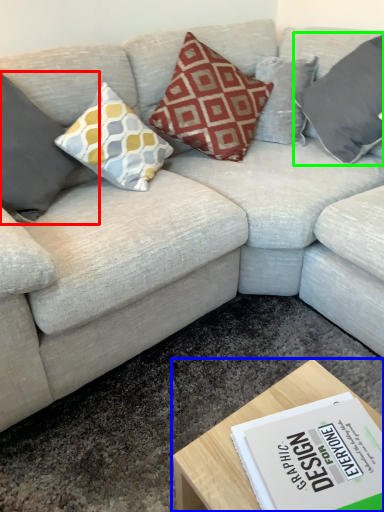
Question: Which is nearer to the pillow (highlighted by a red box)? coffee table (highlighted by a blue box) or pillow (highlighted by a green box).

Choices:
 (A) coffee table
 (B) pillow

Answer: (A)